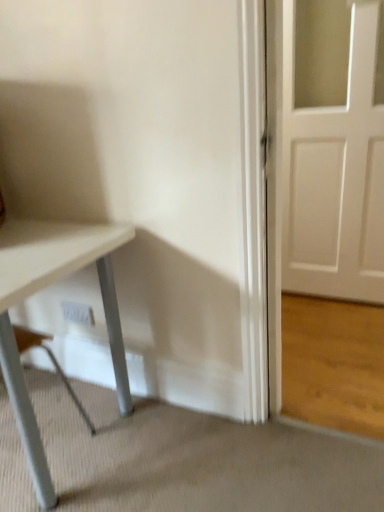
Identify the location of white plastic electric outlet at lower center. The width and height of the screenshot is (384, 512). (78, 313).

Describe the element at coordinates (78, 313) in the screenshot. I see `white plastic electric outlet at lower center` at that location.

Describe the element at coordinates (43, 288) in the screenshot. I see `white matte table at lower left` at that location.

Identify the location of white matte table at lower left. This screenshot has width=384, height=512. (43, 288).

The height and width of the screenshot is (512, 384). Find the location of `white plastic electric outlet at lower center`. white plastic electric outlet at lower center is located at coordinates point(78,313).

Which is more to the left, white plastic electric outlet at lower center or white matte table at lower left?

white matte table at lower left.

Considering the positions of objects white plastic electric outlet at lower center and white matte table at lower left in the image provided, who is behind, white plastic electric outlet at lower center or white matte table at lower left?

white plastic electric outlet at lower center is behind.

Which is closer to the camera, [64,315] or [54,490]?

Positioned in front is point [54,490].

From the image's perspective, is white plastic electric outlet at lower center above or below white matte table at lower left?

Clearly, from the image's perspective, white plastic electric outlet at lower center is above white matte table at lower left.

From a real-world perspective, is white plastic electric outlet at lower center located beneath white matte table at lower left?

Yes, from a real-world perspective, white plastic electric outlet at lower center is under white matte table at lower left.

Between white plastic electric outlet at lower center and white matte table at lower left, which one has smaller width?

Thinner between the two is white plastic electric outlet at lower center.

Can you confirm if white plastic electric outlet at lower center is taller than white matte table at lower left?

Incorrect, the height of white plastic electric outlet at lower center is not larger of that of white matte table at lower left.

Can you confirm if white plastic electric outlet at lower center is bigger than white matte table at lower left?

No.

Would you say white plastic electric outlet at lower center is outside white matte table at lower left?

Yes.

Is white plastic electric outlet at lower center not near white matte table at lower left?

white plastic electric outlet at lower center is near white matte table at lower left, not far away.

Could you tell me if white plastic electric outlet at lower center is turned towards white matte table at lower left?

Yes, white plastic electric outlet at lower center is oriented towards white matte table at lower left.

What's the angular difference between white plastic electric outlet at lower center and white matte table at lower left's facing directions?

176 degrees separate the facing orientations of white plastic electric outlet at lower center and white matte table at lower left.

Measure the distance from white plastic electric outlet at lower center to white matte table at lower left.

white plastic electric outlet at lower center and white matte table at lower left are 17.13 inches apart from each other.

Where is `table on the left side of white plastic electric outlet at lower center`? Image resolution: width=384 pixels, height=512 pixels. table on the left side of white plastic electric outlet at lower center is located at coordinates (43, 288).

Considering the positions of objects white matte table at lower left and white plastic electric outlet at lower center in the image provided, who is more to the left, white matte table at lower left or white plastic electric outlet at lower center?

Positioned to the left is white matte table at lower left.

Relative to white plastic electric outlet at lower center, is white matte table at lower left in front or behind?

white matte table at lower left is positioned closer to the viewer than white plastic electric outlet at lower center.

Does point (6, 368) lie behind point (69, 318)?

No, it is in front of (69, 318).

From the image's perspective, is white matte table at lower left beneath white plastic electric outlet at lower center?

Yes, from the image's perspective, white matte table at lower left is below white plastic electric outlet at lower center.

From a real-world perspective, who is located higher, white matte table at lower left or white plastic electric outlet at lower center?

white matte table at lower left, from a real-world perspective.

Which of these two, white matte table at lower left or white plastic electric outlet at lower center, is thinner?

white plastic electric outlet at lower center is thinner.

Based on the photo, which of these two, white matte table at lower left or white plastic electric outlet at lower center, stands taller?

white matte table at lower left.

Considering the sizes of objects white matte table at lower left and white plastic electric outlet at lower center in the image provided, who is smaller, white matte table at lower left or white plastic electric outlet at lower center?

Smaller between the two is white plastic electric outlet at lower center.

Is white matte table at lower left inside the boundaries of white plastic electric outlet at lower center, or outside?

The correct answer is: outside.

Are white matte table at lower left and white plastic electric outlet at lower center making contact?

They are not placed beside each other.

Is white plastic electric outlet at lower center at the back of white matte table at lower left?

No, white matte table at lower left's orientation is not away from white plastic electric outlet at lower center.

Identify the location of table in front of the white plastic electric outlet at lower center. Image resolution: width=384 pixels, height=512 pixels. [x=43, y=288].

The image size is (384, 512). In order to click on table below the white plastic electric outlet at lower center (from the image's perspective) in this screenshot , I will do `click(43, 288)`.

Image resolution: width=384 pixels, height=512 pixels. Identify the location of electric outlet behind the white matte table at lower left. (78, 313).